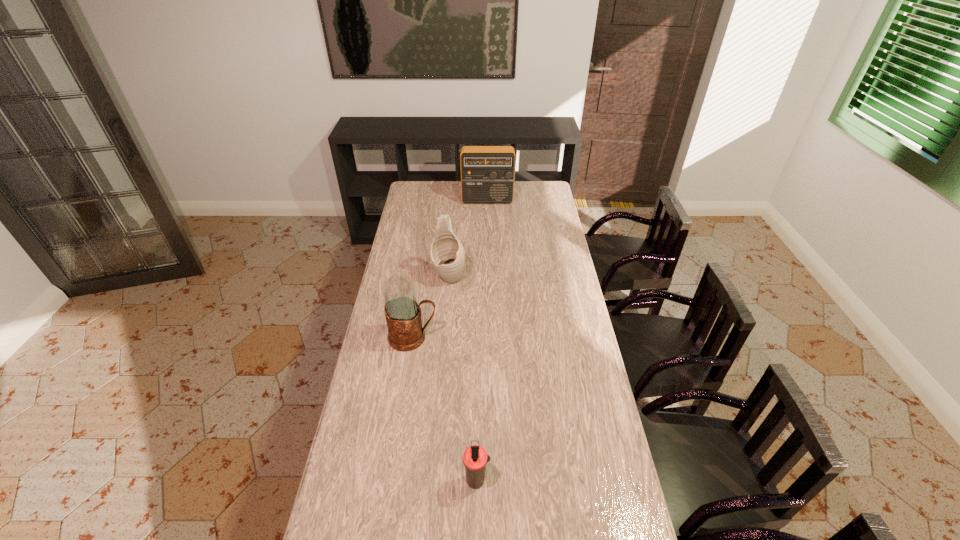
The image size is (960, 540). In order to click on object located in the left edge section of the desktop in this screenshot , I will do `click(403, 314)`.

Locate an element on the screen. The width and height of the screenshot is (960, 540). vacant space at the far edge of the desktop is located at coordinates (440, 194).

Where is `free space at the left edge of the desktop`? This screenshot has height=540, width=960. free space at the left edge of the desktop is located at coordinates (381, 373).

The image size is (960, 540). In the image, there is a desktop. Identify the location of vacant space at the right edge. (549, 347).

Locate an element on the screen. free spot at the far left corner of the desktop is located at coordinates (431, 188).

The height and width of the screenshot is (540, 960). I want to click on free location at the far right corner, so click(547, 197).

Locate an element on the screen. The width and height of the screenshot is (960, 540). vacant space in between the third farthest object and the shortest object is located at coordinates (444, 408).

Where is `empty location between the radio receiver and the thermos bottle`? empty location between the radio receiver and the thermos bottle is located at coordinates (482, 340).

I want to click on blank region between the third nearest object and the thermos bottle, so click(x=463, y=378).

You are a GUI agent. You are given a task and a screenshot of the screen. Output one action in this format:
    pyautogui.click(x=<x>, y=<y>)
    Task: Click on the third closest object relative to the nearer pitcher
    This screenshot has height=540, width=960.
    Given the screenshot: What is the action you would take?
    pyautogui.click(x=487, y=172)